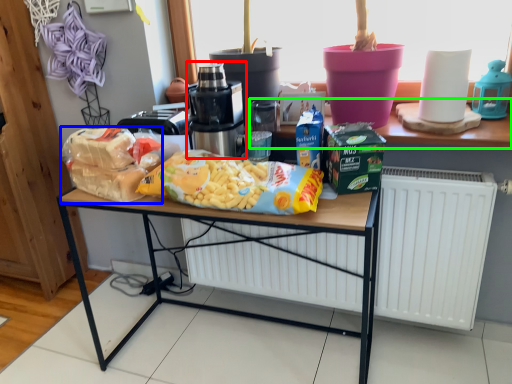
Question: Based on their relative distances, which object is nearer to home appliance (highlighted by a red box)? Choose from waste (highlighted by a blue box) and window sill (highlighted by a green box).

Choices:
 (A) waste
 (B) window sill

Answer: (A)